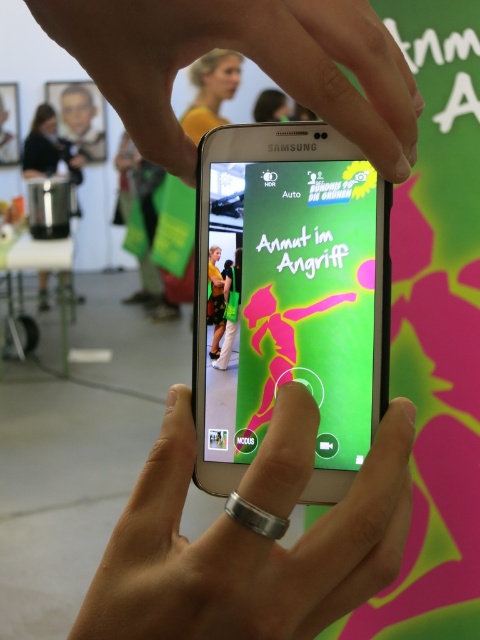
You are a photographer setting up a shot. You have a matte silver phone at center and a metallic silver pot at left. Which object is positioned lower in the frame?

The matte silver phone at center is located below the metallic silver pot at left, so it is positioned lower in the frame.

You are a photographer setting up a shot. You need to position the metallic silver pot at left and the green fabric pants at center so that they are both in focus. Given their heights, which object should you adjust to ensure both are in focus?

The metallic silver pot at left is taller than green fabric pants at center. To ensure both are in focus, you should lower the metallic silver pot at left to match the height of the green fabric pants at center, as the height difference may affect the depth of field required for both objects to be sharp.

You are organizing a photo shoot and need to place the matte silver phone at center and the metallic silver pot at left in a way that maintains their size relationship. Which object should be placed closer to the camera to achieve this?

To maintain the size relationship where the matte silver phone at center is smaller than the metallic silver pot at left, the matte silver phone at center should be placed further away from the camera than the metallic silver pot at left. This way, the phone appears smaller in the photo compared to the pot.